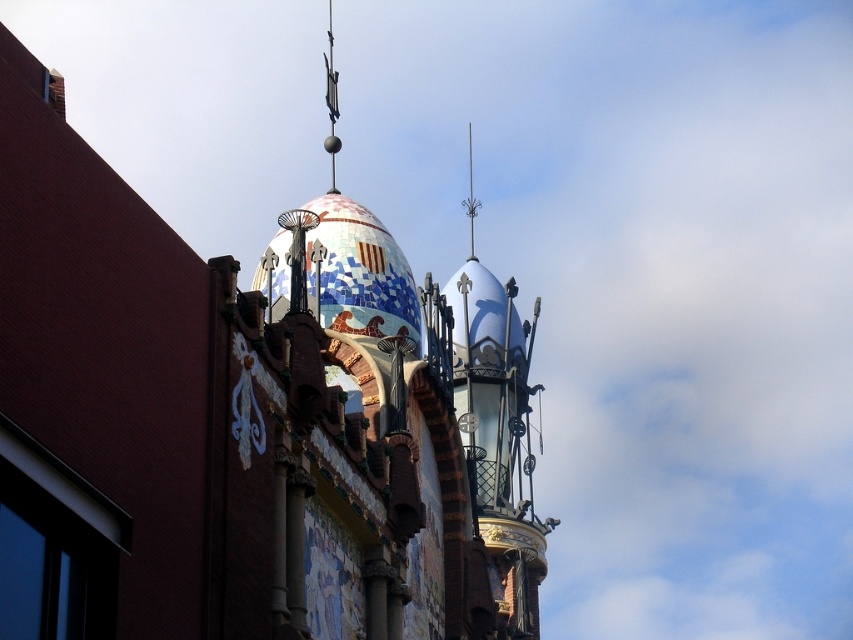
You are an architect analyzing the building. You need to determine which of the two structures, the white glossy dome at upper center or the metallic silver spire at upper center, has a greater horizontal span. Based on the scene, which one is wider?

The white glossy dome at upper center has a greater horizontal span than the metallic silver spire at upper center because its width is larger.

You are an architect examining the building. You notice the mosaic tile dome at center and the metallic silver spire at upper center. Which of these two structures is taller?

The metallic silver spire at upper center is taller than the mosaic tile dome at center.

Based on the photo, you are an architect analyzing the building design. You observe the mosaic tile dome at center and the metallic silver spire at upper center. Which architectural element takes up more visual space in the composition?

The metallic silver spire at upper center occupies more visual space than the mosaic tile dome at center according to the description.